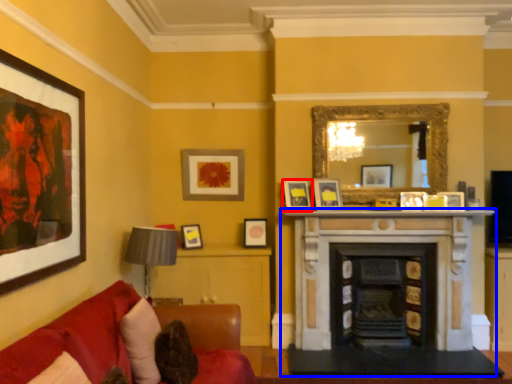
Question: Which of the following is the farthest to the observer, picture frame (highlighted by a red box) or fireplace (highlighted by a blue box)?

Choices:
 (A) picture frame
 (B) fireplace

Answer: (A)